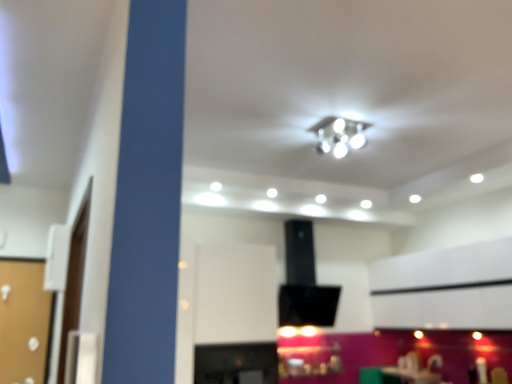
Question: From a real-world perspective, is white glossy light fixture at upper center positioned under matte white table at lower center based on gravity?

Choices:
 (A) no
 (B) yes

Answer: (A)

Question: Is white glossy light fixture at upper center wider than matte white table at lower center?

Choices:
 (A) yes
 (B) no

Answer: (B)

Question: Does white glossy light fixture at upper center lie behind matte white table at lower center?

Choices:
 (A) yes
 (B) no

Answer: (B)

Question: Does white glossy light fixture at upper center have a lesser width compared to matte white table at lower center?

Choices:
 (A) yes
 (B) no

Answer: (A)

Question: Considering the relative positions of white glossy light fixture at upper center and matte white table at lower center in the image provided, is white glossy light fixture at upper center to the left of matte white table at lower center from the viewer's perspective?

Choices:
 (A) yes
 (B) no

Answer: (A)

Question: Can you confirm if white glossy light fixture at upper center is bigger than matte white table at lower center?

Choices:
 (A) no
 (B) yes

Answer: (A)

Question: Does matte white table at lower center have a greater width compared to white glossy light fixture at upper center?

Choices:
 (A) yes
 (B) no

Answer: (A)

Question: From a real-world perspective, is matte white table at lower center positioned over white glossy light fixture at upper center based on gravity?

Choices:
 (A) no
 (B) yes

Answer: (A)

Question: Is white glossy light fixture at upper center located within matte white table at lower center?

Choices:
 (A) no
 (B) yes

Answer: (A)

Question: Does matte white table at lower center have a lesser height compared to white glossy light fixture at upper center?

Choices:
 (A) no
 (B) yes

Answer: (A)

Question: Does matte white table at lower center have a larger size compared to white glossy light fixture at upper center?

Choices:
 (A) no
 (B) yes

Answer: (B)

Question: From the image's perspective, is matte white table at lower center below white glossy light fixture at upper center?

Choices:
 (A) no
 (B) yes

Answer: (B)

Question: From the image's perspective, is white glossy light fixture at upper center positioned above or below matte white table at lower center?

Choices:
 (A) below
 (B) above

Answer: (B)